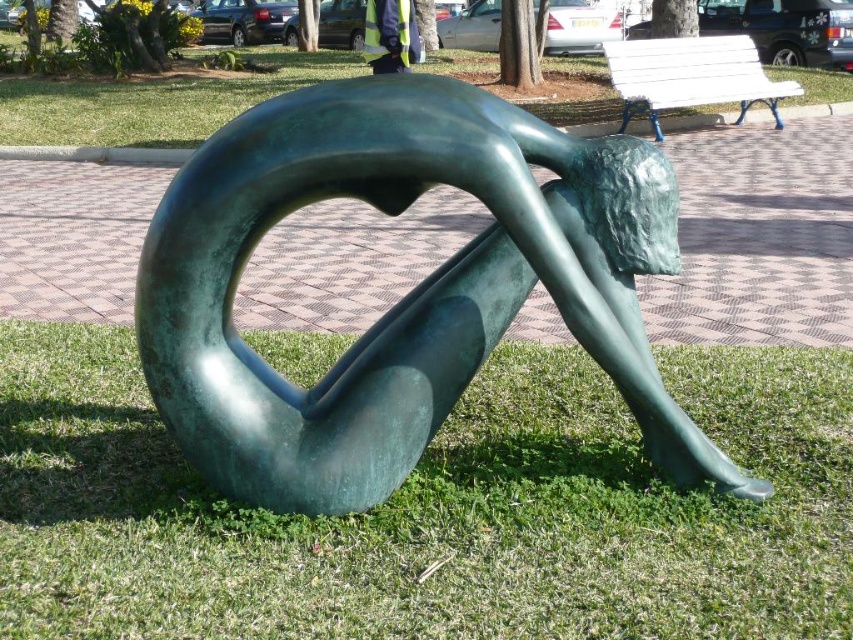
Question: Among these points, which one is nearest to the camera?

Choices:
 (A) (688, 524)
 (B) (780, 122)
 (C) (405, 35)

Answer: (A)

Question: Can you confirm if green patina sculpture at center is positioned to the left of yellow reflective vest at center?

Choices:
 (A) no
 (B) yes

Answer: (A)

Question: Which of the following is the farthest from the observer?

Choices:
 (A) yellow reflective vest at center
 (B) white wooden bench at upper right
 (C) green grass at lower center
 (D) green patina sculpture at center

Answer: (A)

Question: Is white wooden bench at upper right closer to the viewer compared to yellow reflective vest at center?

Choices:
 (A) no
 (B) yes

Answer: (B)

Question: Among these objects, which one is nearest to the camera?

Choices:
 (A) green grass at lower center
 (B) yellow reflective vest at center
 (C) white wooden bench at upper right
 (D) green patina sculpture at center

Answer: (A)

Question: Is green patina sculpture at center in front of yellow reflective vest at center?

Choices:
 (A) yes
 (B) no

Answer: (A)